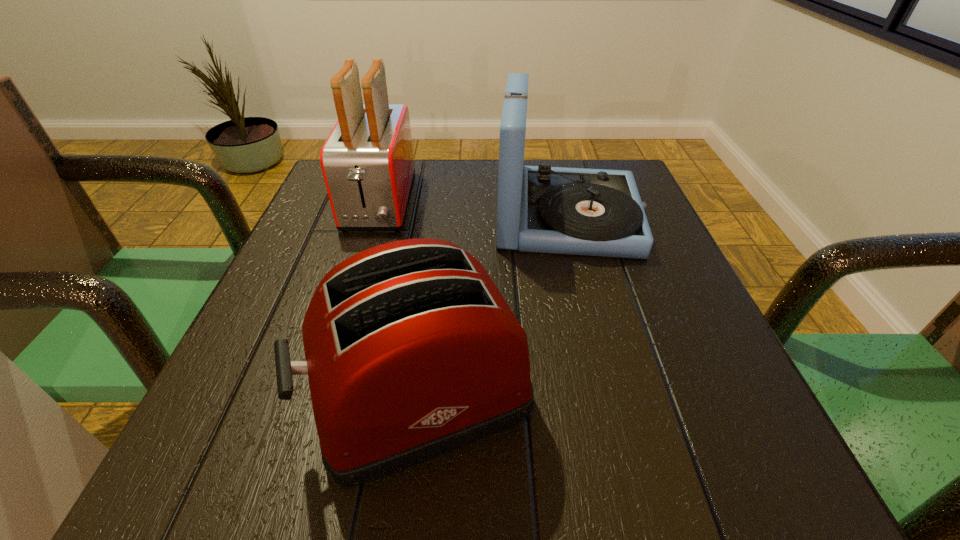
You are a GUI agent. You are given a task and a screenshot of the screen. Output one action in this format:
    pyautogui.click(x=<x>, y=<y>)
    Task: Click on the taller toaster
    
    Given the screenshot: What is the action you would take?
    pyautogui.click(x=367, y=161)

Locate an element on the screen. This screenshot has width=960, height=540. phonograph record is located at coordinates (597, 212).

Image resolution: width=960 pixels, height=540 pixels. I want to click on the shorter toaster, so click(411, 351).

Locate an element on the screen. This screenshot has width=960, height=540. the nearest object is located at coordinates (411, 351).

This screenshot has height=540, width=960. Identify the location of free spot located 0.060m on the front-facing side of the farther toaster. (361, 259).

I want to click on vacant region located 0.280m on the front of the phonograph record, so click(612, 389).

Identify the location of vacant region located 0.060m on the right of the nearest object. Image resolution: width=960 pixels, height=540 pixels. (575, 395).

Identify the location of toaster present at the far edge. This screenshot has height=540, width=960. (367, 161).

The width and height of the screenshot is (960, 540). I want to click on phonograph record present at the far edge, so (x=597, y=212).

You are a GUI agent. You are given a task and a screenshot of the screen. Output one action in this format:
    pyautogui.click(x=<x>, y=<y>)
    Task: Click on the object present at the near edge
    The width and height of the screenshot is (960, 540).
    Given the screenshot: What is the action you would take?
    pyautogui.click(x=411, y=351)